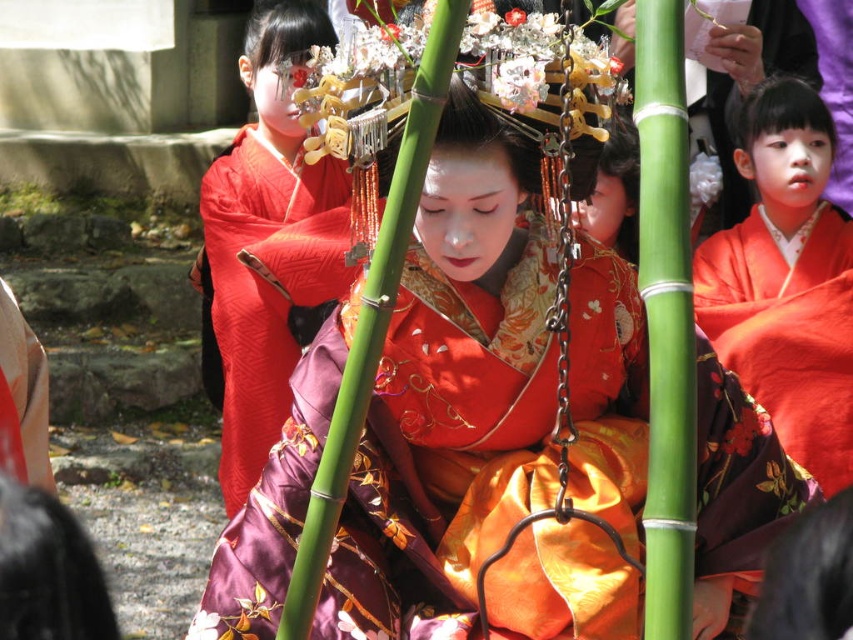
Question: Which point appears farthest from the camera in this image?

Choices:
 (A) (737, 145)
 (B) (213, 212)

Answer: (A)

Question: Estimate the real-world distances between objects in this image. Which object is closer to the silky orange kimono at right?

Choices:
 (A) silky red kimono at center
 (B) satin kimono at center

Answer: (A)

Question: Which point is closer to the camera taking this photo?

Choices:
 (A) (808, 428)
 (B) (221, 452)
 (C) (457, 451)

Answer: (C)

Question: Can you confirm if satin kimono at center is positioned to the right of silky orange kimono at right?

Choices:
 (A) yes
 (B) no

Answer: (B)

Question: Can you confirm if satin kimono at center is wider than silky orange kimono at right?

Choices:
 (A) yes
 (B) no

Answer: (A)

Question: Does satin kimono at center come behind silky orange kimono at right?

Choices:
 (A) yes
 (B) no

Answer: (B)